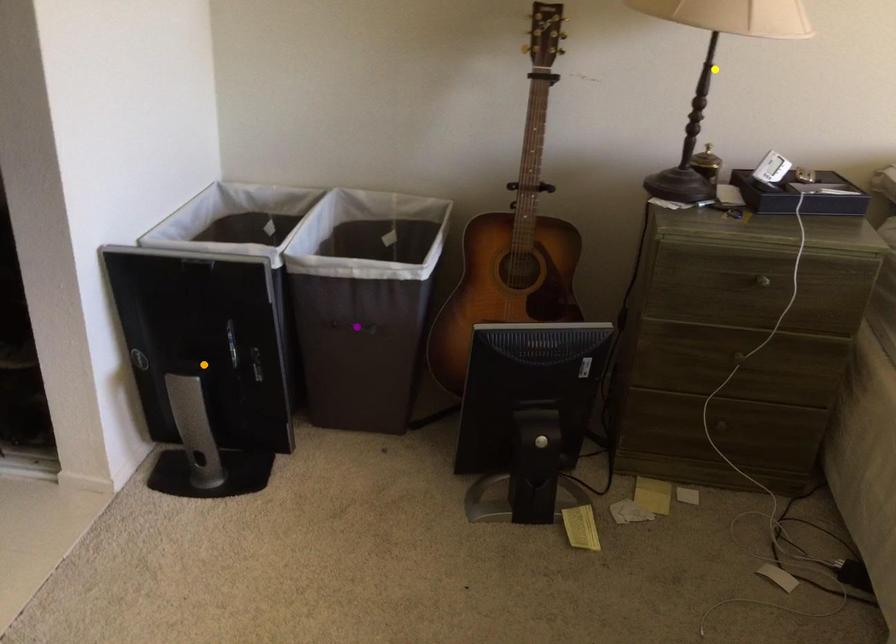
Order these from nearest to farthest:
1. yellow point
2. purple point
3. orange point

purple point
orange point
yellow point